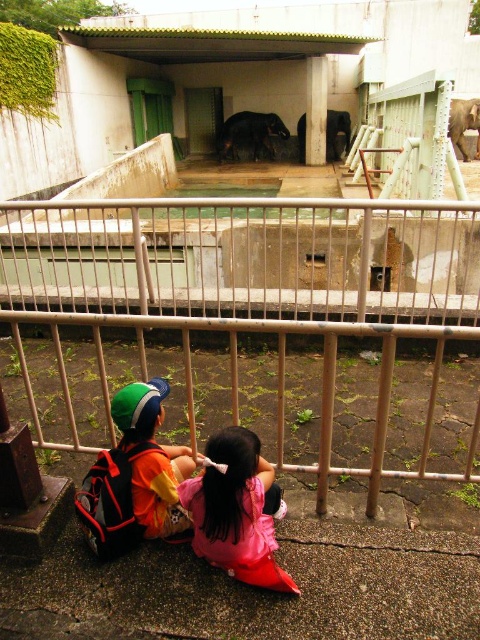
Question: Is dark brown elephant at center in front of gray textured elephant at upper right?

Choices:
 (A) no
 (B) yes

Answer: (A)

Question: Does gray textured elephant at upper right have a smaller size compared to shiny black elephant at center?

Choices:
 (A) yes
 (B) no

Answer: (B)

Question: Which object is closer to the camera taking this photo?

Choices:
 (A) dark brown elephant at center
 (B) pink fabric at lower center
 (C) gray textured elephant at upper right

Answer: (B)

Question: Which of the following is the farthest from the observer?

Choices:
 (A) click(225, 132)
 (B) click(450, 113)
 (C) click(336, 150)
 (D) click(175, 524)

Answer: (A)

Question: Is pink fabric at lower center above shiny black elephant at center?

Choices:
 (A) yes
 (B) no

Answer: (B)

Question: Among these points, which one is farthest from the camera?

Choices:
 (A) (348, 129)
 (B) (274, 150)
 (C) (160, 464)

Answer: (B)